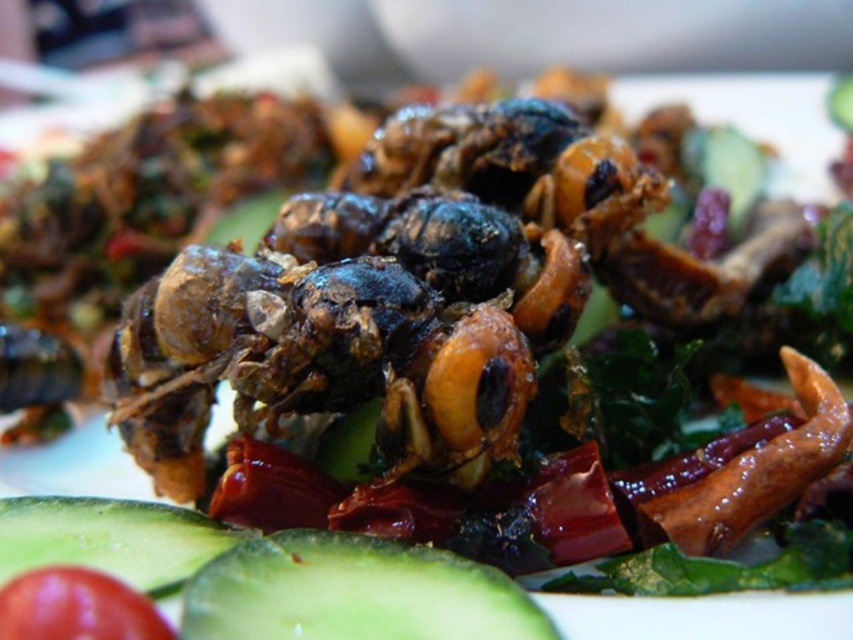
Based on the photo, you are a food critic inspecting a dish that includes insects and vegetables. You notice two cucumbers at the lower left of the dish. Which cucumber is positioned lower between the green smooth cucumber at lower left and the green matte cucumber at lower left?

The green smooth cucumber at lower left is positioned lower than the green matte cucumber at lower left because it is described as being below it.

You are a chef preparing a dish and need to know which cucumber has a larger diameter. You see two cucumbers in the dish, one labeled as green smooth cucumber at lower left and the other as green matte cucumber at lower left. Which one is wider?

The green smooth cucumber at lower left might be wider than green matte cucumber at lower left according to the description.

You are a chef preparing a dish and need to place a green smooth cucumber at lower left and a red matte tomato at lower left on a plate. The plate has a diameter of 12 inches. Can both items fit on the plate without overlapping?

The green smooth cucumber at lower left is 4.38 inches from the red matte tomato at lower left. Since the plate has a diameter of 12 inches, which is much larger than the distance between them, both items can fit on the plate without overlapping.